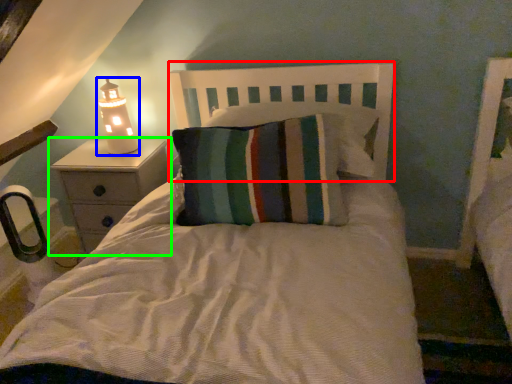
Question: Estimate the real-world distances between objects in this image. Which object is farther from headboard (highlighted by a red box), lamp (highlighted by a blue box) or nightstand (highlighted by a green box)?

Choices:
 (A) lamp
 (B) nightstand

Answer: (A)